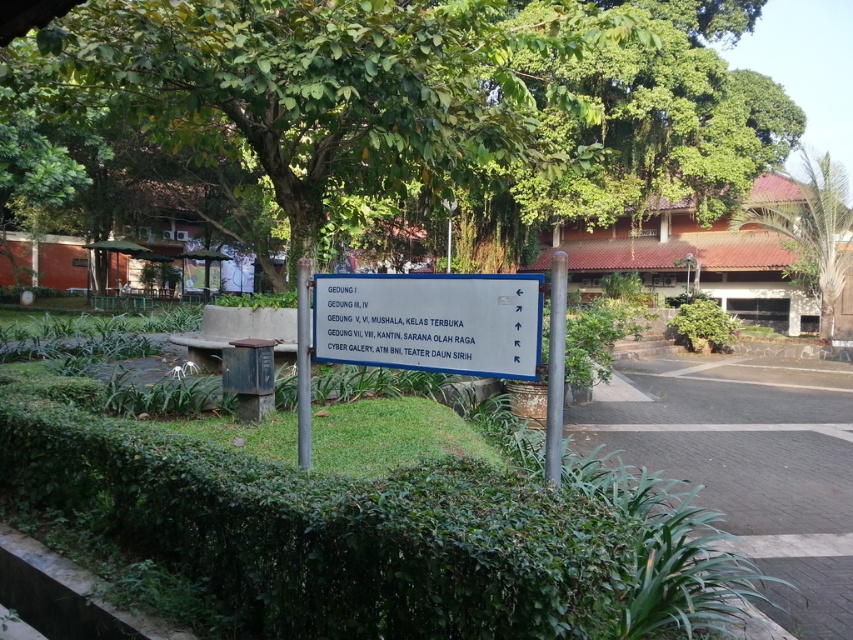
You are a visitor at this location and want to take a photo of both green leafy hedge at lower center and green leafy hedge at center. Which hedge should you focus on first to ensure both are in the frame?

You should focus on the green leafy hedge at lower center first because it is closer to you, so adjusting the camera to include it will naturally include the farther green leafy hedge at center as well.

Based on the photo, you are a visitor at this campus and need to find the nearest shaded area. The signpost mentions several buildings but not the greenery. Based on the image, which object would provide more shade between the green leafy palm tree at upper right and the green leafy hedge at center?

The green leafy palm tree at upper right is above the green leafy hedge at center, so it likely provides more shade due to its height and position.

In the scene shown: You are a visitor trying to locate the Cyber Galery. You see the green leafy palm tree at upper right and the green leafy hedge at center. Which object is closer to the Cyber Galery?

The green leafy palm tree at upper right is positioned on the right side of green leafy hedge at center. Since the Cyber Galery is listed on the signpost near the palm tree, it is likely closer to the palm tree.